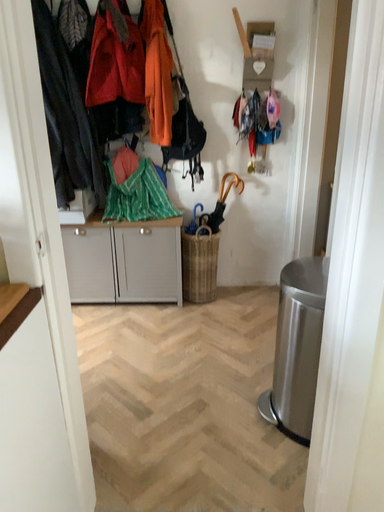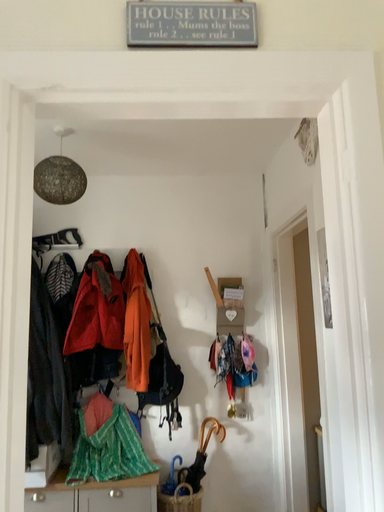
Question: Which way did the camera rotate in the video?

Choices:
 (A) rotated upward
 (B) rotated downward

Answer: (A)